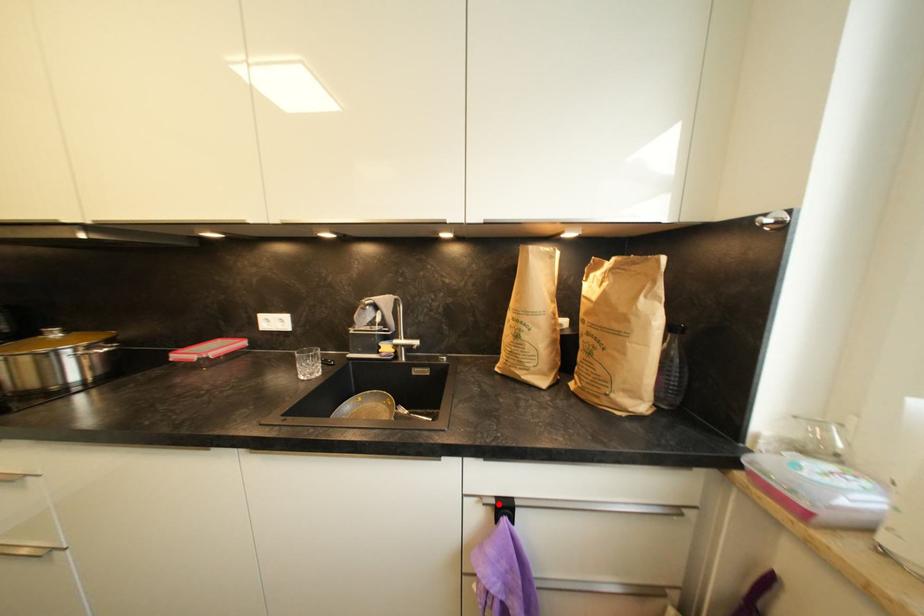
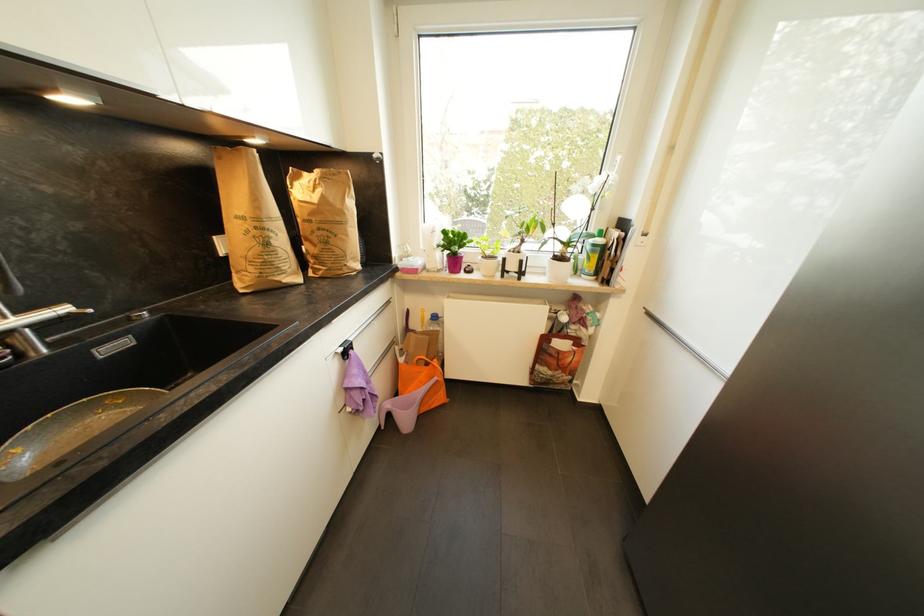
In the second image, find the point that corresponds to the highlighted location in the first image.

(346, 351)